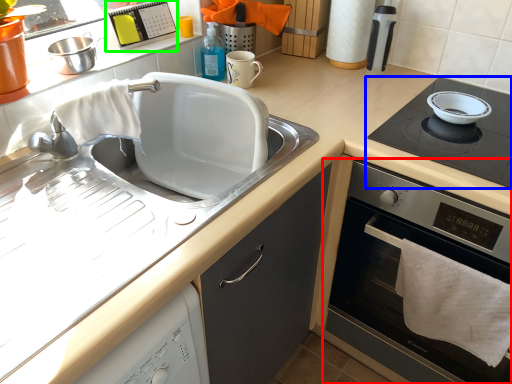
Question: Estimate the real-world distances between objects in this image. Which object is closer to home appliance (highlighted by a red box), gas stove (highlighted by a blue box) or appliance (highlighted by a green box)?

Choices:
 (A) gas stove
 (B) appliance

Answer: (A)